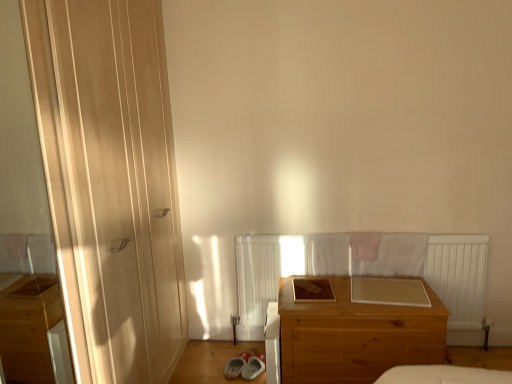
Question: Can you see transparent glass screen door at left touching matte wood door at left?

Choices:
 (A) no
 (B) yes

Answer: (A)

Question: From the image's perspective, is transparent glass screen door at left on top of matte wood door at left?

Choices:
 (A) no
 (B) yes

Answer: (A)

Question: Is transparent glass screen door at left outside of matte wood door at left?

Choices:
 (A) no
 (B) yes

Answer: (B)

Question: Is transparent glass screen door at left wider than matte wood door at left?

Choices:
 (A) yes
 (B) no

Answer: (B)

Question: From the image's perspective, would you say transparent glass screen door at left is shown under matte wood door at left?

Choices:
 (A) yes
 (B) no

Answer: (A)

Question: Considering the positions of point (86, 362) and point (31, 211), is point (86, 362) closer or farther from the camera than point (31, 211)?

Choices:
 (A) farther
 (B) closer

Answer: (B)

Question: From the image's perspective, relative to transparent glass screen door at left, is matte wood door at left above or below?

Choices:
 (A) above
 (B) below

Answer: (A)

Question: Is matte wood door at left wider or thinner than transparent glass screen door at left?

Choices:
 (A) thin
 (B) wide

Answer: (B)

Question: Is matte wood door at left inside or outside of transparent glass screen door at left?

Choices:
 (A) outside
 (B) inside

Answer: (A)

Question: In the image, is transparent glass screen door at left on the left side or the right side of matte wood door at left?

Choices:
 (A) left
 (B) right

Answer: (A)

Question: From their relative heights in the image, would you say transparent glass screen door at left is taller or shorter than matte wood door at left?

Choices:
 (A) tall
 (B) short

Answer: (B)

Question: In terms of width, does transparent glass screen door at left look wider or thinner when compared to matte wood door at left?

Choices:
 (A) wide
 (B) thin

Answer: (B)

Question: Which is correct: transparent glass screen door at left is inside matte wood door at left, or outside of it?

Choices:
 (A) inside
 (B) outside

Answer: (B)

Question: Considering the positions of matte wood door at left and wooden chest of drawers at center in the image, is matte wood door at left taller or shorter than wooden chest of drawers at center?

Choices:
 (A) tall
 (B) short

Answer: (A)

Question: Based on their sizes in the image, would you say matte wood door at left is bigger or smaller than wooden chest of drawers at center?

Choices:
 (A) big
 (B) small

Answer: (B)